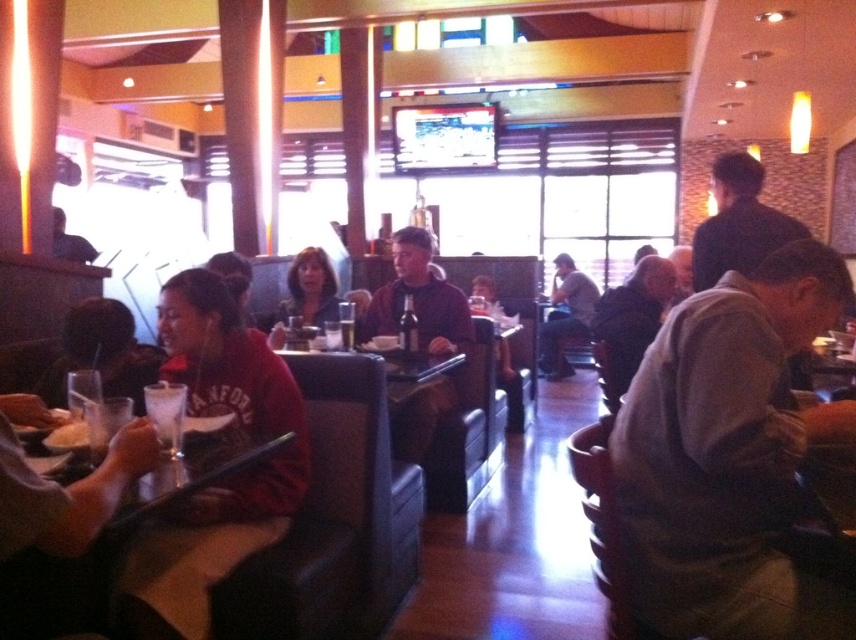
Between brown sweater at center and dark brown hair at upper right, which one has less height?

dark brown hair at upper right

Is brown sweater at center bigger than dark brown hair at upper right?

Incorrect, brown sweater at center is not larger than dark brown hair at upper right.

Measure the distance between point (423, 419) and camera.

Point (423, 419) is 10.75 feet from camera.

I want to click on brown sweater at center, so click(x=418, y=300).

Is point (539, 330) positioned after point (81, 424)?

Yes, it is.

Is point (562, 360) positioned before point (80, 436)?

No, (562, 360) is further to viewer.

Is point (553, 314) closer to viewer compared to point (75, 422)?

No, (553, 314) is further to viewer.

Image resolution: width=856 pixels, height=640 pixels. I want to click on dark gray shirt at center, so click(x=565, y=316).

Who is positioned more to the right, dark brown hair at upper right or dark gray shirt at center?

From the viewer's perspective, dark gray shirt at center appears more on the right side.

Can you confirm if dark brown hair at upper right is smaller than dark gray shirt at center?

Yes.

You are a GUI agent. You are given a task and a screenshot of the screen. Output one action in this format:
    pyautogui.click(x=<x>, y=<y>)
    Task: Click on the dark brown hair at upper right
    The height and width of the screenshot is (640, 856).
    Given the screenshot: What is the action you would take?
    pyautogui.click(x=738, y=221)